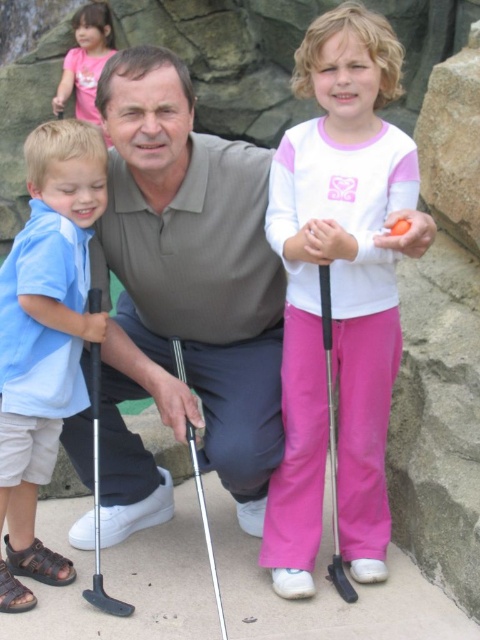
Where is the matte gray polo shirt at center located in the image?

The matte gray polo shirt at center is located at the point with coordinates 0.461 on the x axis and 0.383 on the y axis.

You are a photographer trying to capture a group photo of the matte gray polo shirt at center and the blue cotton shirt at left. Which person should you position to the left side of the frame to ensure they are aligned with the existing background elements?

The blue cotton shirt at left should be positioned to the left side of the frame because the matte gray polo shirt at center is already on the right side of the blue cotton shirt at left, so moving the blue cotton shirt at left further left would align them with the background elements.

You are a photographer trying to capture a photo of the matte gray polo shirt at center and the black plastic golf club at lower center. Which object should you focus on if you want to capture the larger one in your shot?

The matte gray polo shirt at center is bigger than the black plastic golf club at lower center, so you should focus on the matte gray polo shirt at center to capture the larger one.